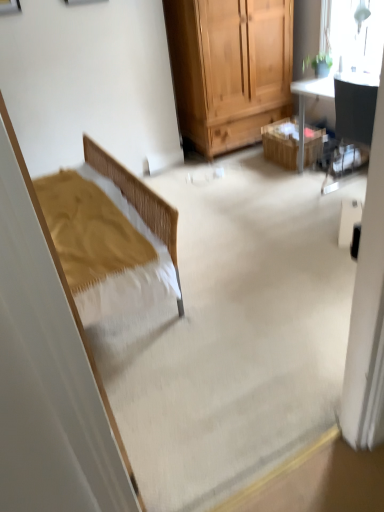
Question: From a real-world perspective, is transparent glass window at upper right under wooden picnic basket at center?

Choices:
 (A) yes
 (B) no

Answer: (B)

Question: Does transparent glass window at upper right have a greater height compared to wooden picnic basket at center?

Choices:
 (A) no
 (B) yes

Answer: (B)

Question: Does transparent glass window at upper right have a larger size compared to wooden picnic basket at center?

Choices:
 (A) no
 (B) yes

Answer: (A)

Question: Is transparent glass window at upper right to the right of wooden picnic basket at center from the viewer's perspective?

Choices:
 (A) no
 (B) yes

Answer: (B)

Question: Is transparent glass window at upper right facing towards wooden picnic basket at center?

Choices:
 (A) no
 (B) yes

Answer: (A)

Question: Does transparent glass window at upper right have a lesser width compared to wooden picnic basket at center?

Choices:
 (A) no
 (B) yes

Answer: (B)

Question: Does matte black chair at upper right lie behind transparent glass window at upper right?

Choices:
 (A) yes
 (B) no

Answer: (B)

Question: Does matte black chair at upper right appear on the right side of transparent glass window at upper right?

Choices:
 (A) yes
 (B) no

Answer: (A)

Question: Are matte black chair at upper right and transparent glass window at upper right located far from each other?

Choices:
 (A) no
 (B) yes

Answer: (A)

Question: Can you confirm if matte black chair at upper right is wider than transparent glass window at upper right?

Choices:
 (A) yes
 (B) no

Answer: (A)

Question: Does matte black chair at upper right have a lesser width compared to transparent glass window at upper right?

Choices:
 (A) no
 (B) yes

Answer: (A)

Question: Is matte black chair at upper right oriented towards transparent glass window at upper right?

Choices:
 (A) no
 (B) yes

Answer: (A)

Question: Is matte black chair at upper right positioned far away from wooden picnic basket at center?

Choices:
 (A) yes
 (B) no

Answer: (B)